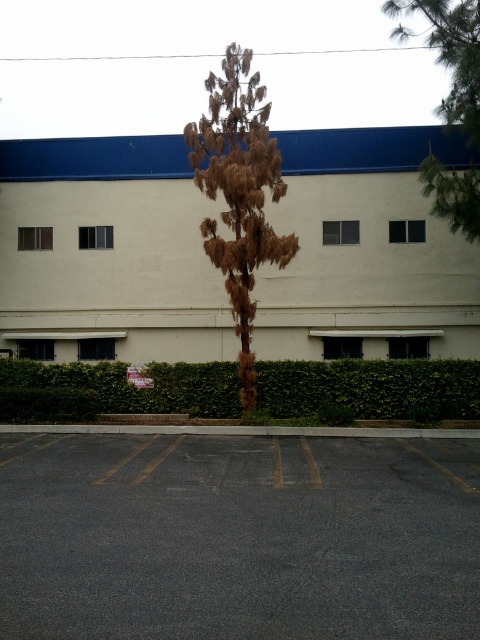
The height and width of the screenshot is (640, 480). What do you see at coordinates (239, 193) in the screenshot?
I see `brown textured tree at center` at bounding box center [239, 193].

Locate an element on the screen. This screenshot has height=640, width=480. brown textured tree at center is located at coordinates (239, 193).

Between gray asphalt parking lot at lower center and brown textured tree at upper right, which one has less height?

Standing shorter between the two is gray asphalt parking lot at lower center.

Where is `gray asphalt parking lot at lower center`? The image size is (480, 640). gray asphalt parking lot at lower center is located at coordinates (238, 538).

This screenshot has width=480, height=640. In order to click on gray asphalt parking lot at lower center in this screenshot , I will do `click(238, 538)`.

Image resolution: width=480 pixels, height=640 pixels. What do you see at coordinates (371, 387) in the screenshot?
I see `green leafy hedge at lower center` at bounding box center [371, 387].

Image resolution: width=480 pixels, height=640 pixels. What are the coordinates of `green leafy hedge at lower center` in the screenshot? It's located at [371, 387].

Where is `green leafy hedge at lower center`? The image size is (480, 640). green leafy hedge at lower center is located at coordinates (371, 387).